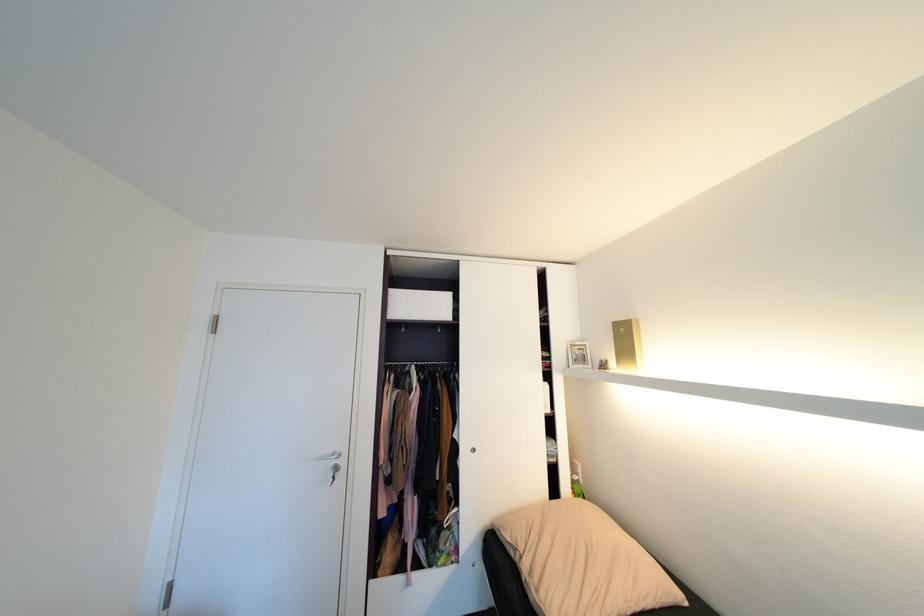
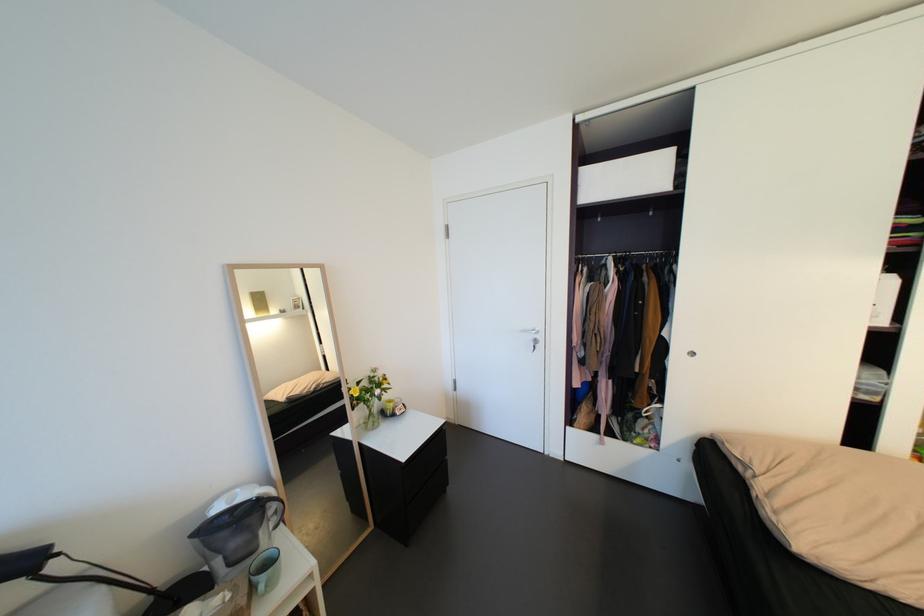
Find the pixel in the second image that matches the point at 341,455 in the first image.

(541, 331)